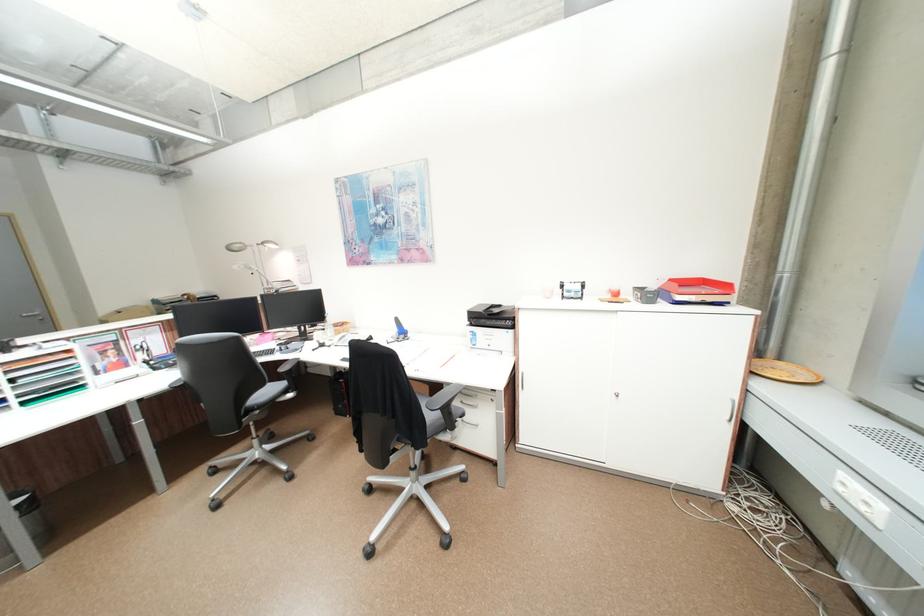
Find where to placing paper the red paper tray. Please return your answer as a coordinate pair (x, y).

(697, 291)